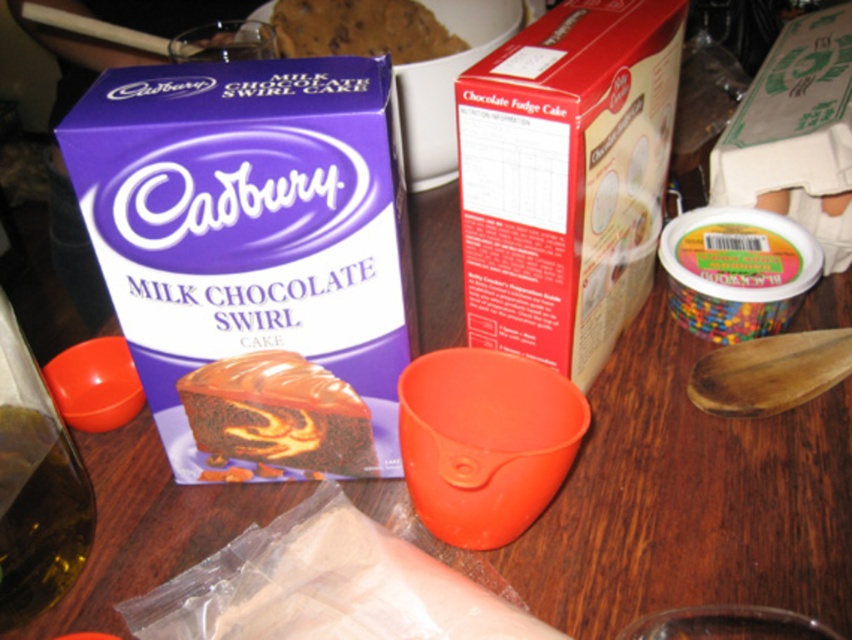
Looking at this image, can you confirm if red cardboard box at center is smaller than translucent amber liquid at lower left?

No.

Can you confirm if red cardboard box at center is bigger than translucent amber liquid at lower left?

Indeed, red cardboard box at center has a larger size compared to translucent amber liquid at lower left.

Is point (589, 310) less distant than point (59, 508)?

No, it is behind (59, 508).

The image size is (852, 640). Identify the location of red cardboard box at center. (566, 179).

Who is higher up, swirled chocolate cake at center or chocolate chip cookie at upper center?

chocolate chip cookie at upper center

Measure the distance between point (281, 449) and camera.

A distance of 19.11 inches exists between point (281, 449) and camera.

Which is in front, point (190, 372) or point (309, 33)?

Point (190, 372) is more forward.

The width and height of the screenshot is (852, 640). I want to click on swirled chocolate cake at center, so tap(278, 413).

Does purple cardboard box at upper left have a greater width compared to red cardboard box at center?

In fact, purple cardboard box at upper left might be narrower than red cardboard box at center.

Looking at this image, can you confirm if purple cardboard box at upper left is positioned to the left of red cardboard box at center?

Yes, purple cardboard box at upper left is to the left of red cardboard box at center.

Is point (142, 230) behind point (596, 81)?

No, (142, 230) is closer to viewer.

I want to click on purple cardboard box at upper left, so click(x=254, y=259).